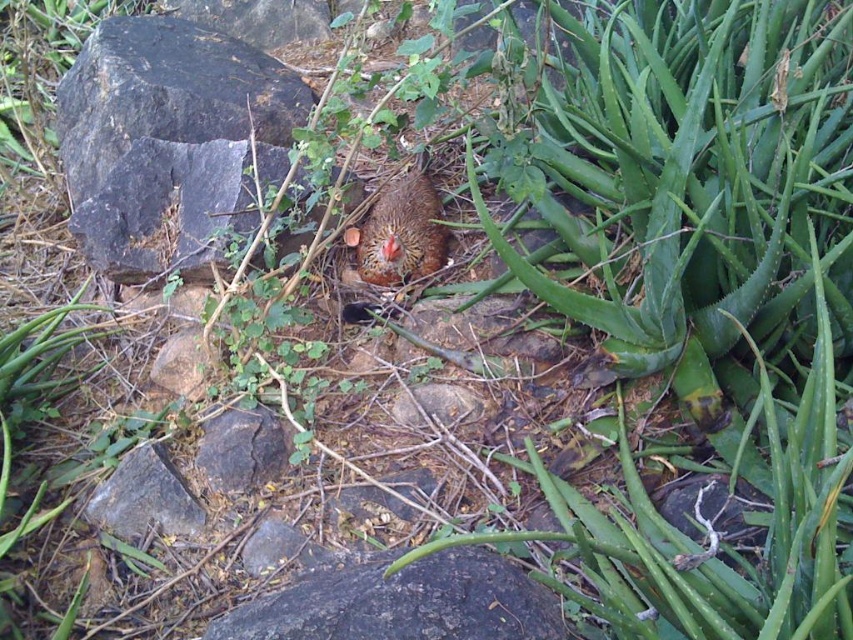
You are standing in the outdoor area and want to pick up the brown speckled chicken at center. However, there is a black rough rock at center blocking your path. Can you reach the chicken without moving the rock?

The black rough rock at center is closer to the viewer than the brown speckled chicken at center, so you cannot reach the chicken without moving the rock because the rock is in front of it.

You are a small dog trying to walk through the space between the black rough rock at center and the brown speckled chicken at center. Can you fit through the space if your width is 30 cm?

The black rough rock at center is wider than the brown speckled chicken at center. However, the exact width of the space between them isn